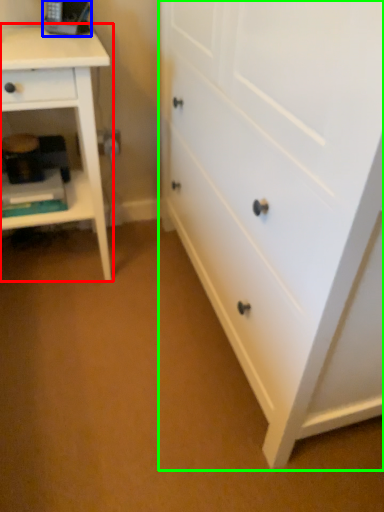
Question: Which is farther away from nightstand (highlighted by a red box)? equipment (highlighted by a blue box) or chest of drawers (highlighted by a green box)?

Choices:
 (A) equipment
 (B) chest of drawers

Answer: (B)